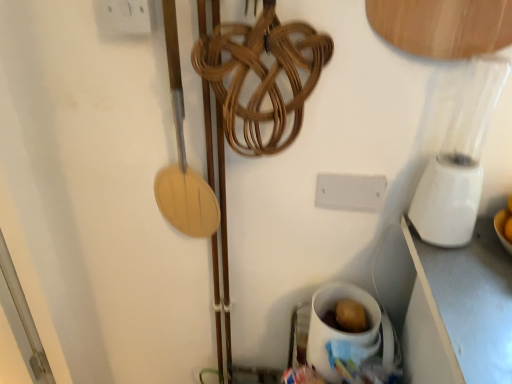
Question: Is white ceramic mug at lower right situated inside white plastic electric outlet at upper left or outside?

Choices:
 (A) outside
 (B) inside

Answer: (A)

Question: Is white ceramic mug at lower right in front of or behind white plastic electric outlet at upper left in the image?

Choices:
 (A) front
 (B) behind

Answer: (B)

Question: Based on their relative distances, which object is nearer to the white plastic electric outlet at upper left?

Choices:
 (A) white ceramic mug at lower right
 (B) white plastic blender at right

Answer: (B)

Question: Which object is the farthest from the white plastic electric outlet at upper left?

Choices:
 (A) white ceramic mug at lower right
 (B) white plastic blender at right

Answer: (A)